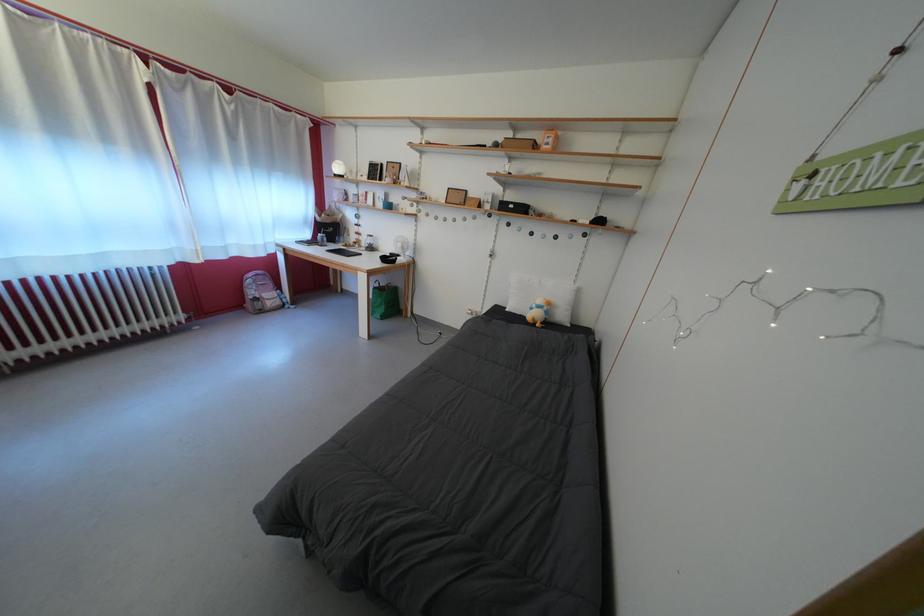
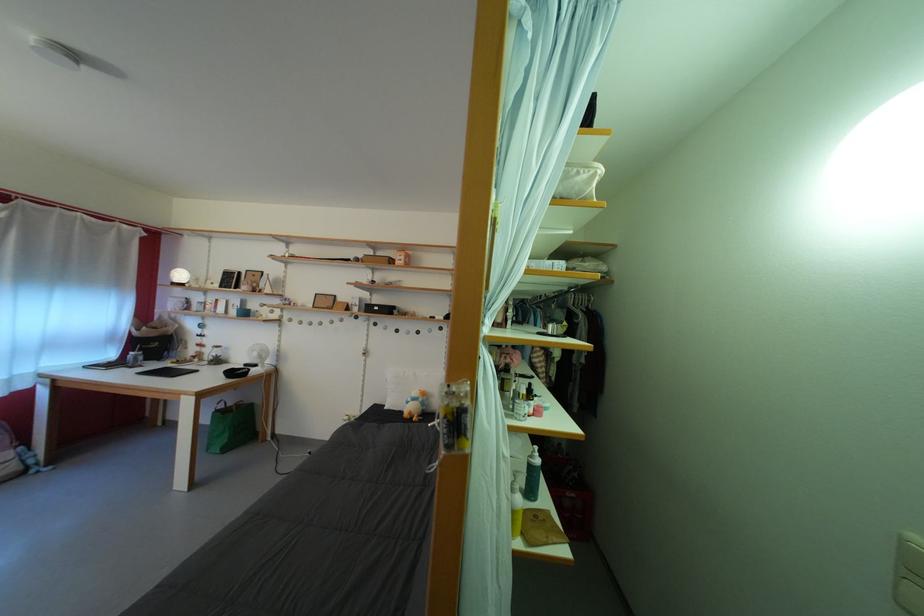
Find the pixel in the second image that matches the point at 383,294 in the first image.

(225, 416)